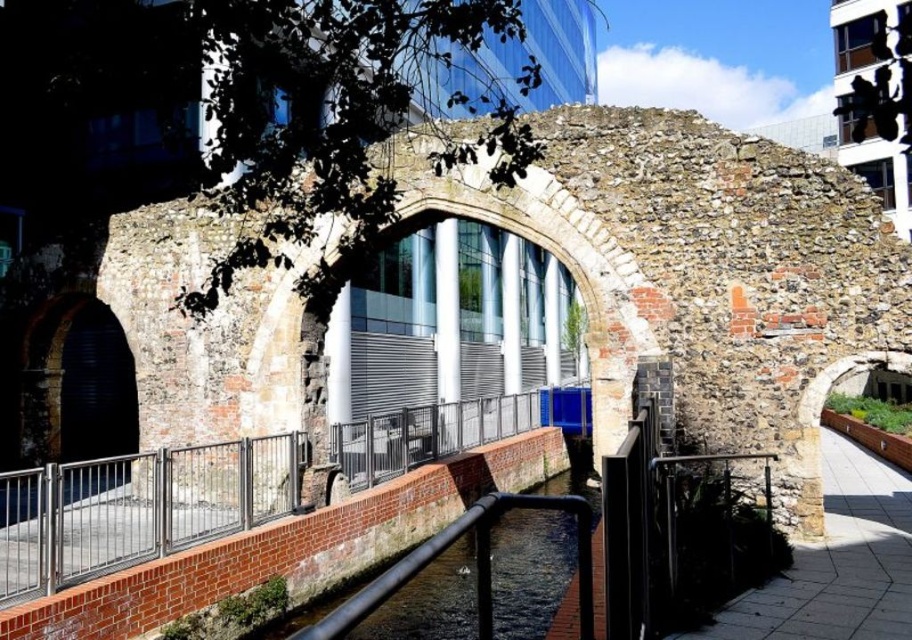
You are a painter who wants to paint a scene that includes both the stainless steel railing at lower center and the smooth stone path at lower right. Which object should you paint first if you follow the rule of painting taller objects before shorter ones?

The stainless steel railing at lower center is much taller than the smooth stone path at lower right, so you should paint the stainless steel railing at lower center first.